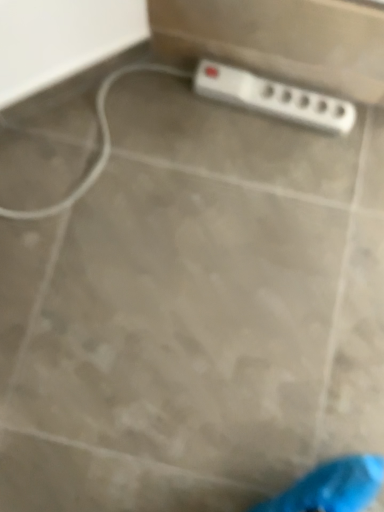
The height and width of the screenshot is (512, 384). What do you see at coordinates (274, 98) in the screenshot?
I see `white plastic power plugs and sockets at upper right` at bounding box center [274, 98].

Measure the distance between white plastic power plugs and sockets at upper right and camera.

white plastic power plugs and sockets at upper right and camera are 38.16 inches apart.

Identify the location of white plastic power plugs and sockets at upper right. (274, 98).

This screenshot has width=384, height=512. What are the coordinates of `white plastic power plugs and sockets at upper right` in the screenshot? It's located at (274, 98).